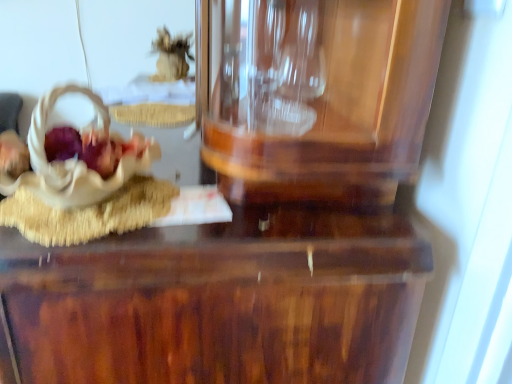
Find the location of a particular element. vacant region to the right of beige fabric basket at left, the second stuff positioned from the top is located at coordinates (214, 212).